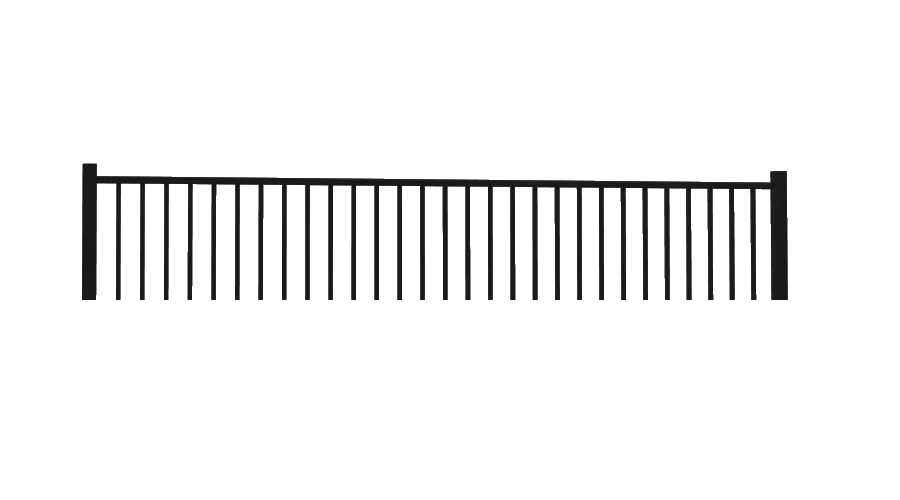
The height and width of the screenshot is (500, 900). What are the coordinates of `bar` in the screenshot? It's located at (103, 254).